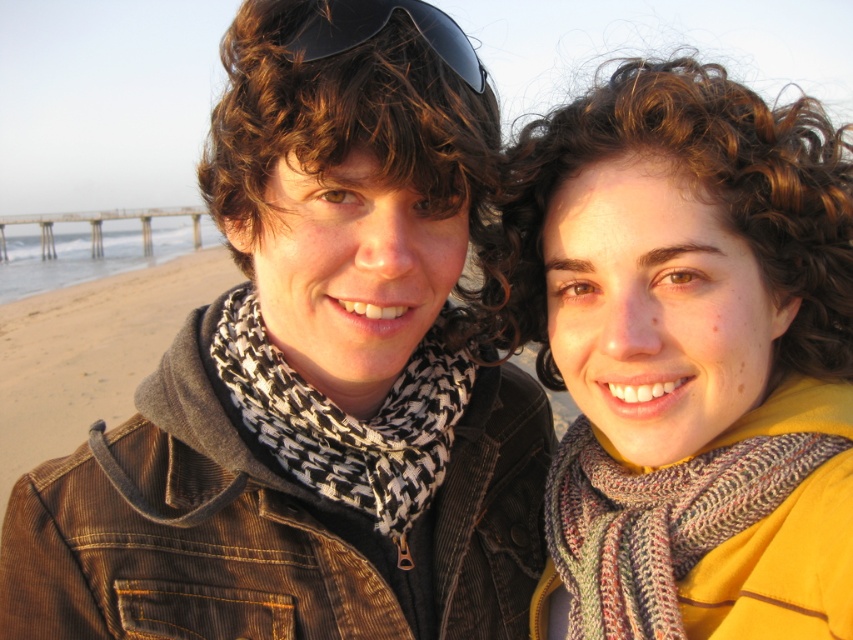
Does knitted scarf at center have a lesser height compared to knitted multicolored scarf at right?

No.

You are a GUI agent. You are given a task and a screenshot of the screen. Output one action in this format:
    pyautogui.click(x=<x>, y=<y>)
    Task: Click on the knitted scarf at center
    This screenshot has width=853, height=640.
    Given the screenshot: What is the action you would take?
    pyautogui.click(x=689, y=356)

You are a GUI agent. You are given a task and a screenshot of the screen. Output one action in this format:
    pyautogui.click(x=<x>, y=<y>)
    Task: Click on the knitted scarf at center
    
    Given the screenshot: What is the action you would take?
    pyautogui.click(x=689, y=356)

Who is taller, knitted scarf at center or houndstooth knitted scarf at center?

With more height is knitted scarf at center.

Is knitted scarf at center thinner than houndstooth knitted scarf at center?

No.

This screenshot has width=853, height=640. I want to click on knitted scarf at center, so click(689, 356).

In the scene shown: Can you confirm if knitted multicolored scarf at right is positioned below black matte sunglasses at upper center?

Yes, knitted multicolored scarf at right is below black matte sunglasses at upper center.

Between point (602, 540) and point (315, 33), which one is positioned in front?

Point (315, 33)

This screenshot has width=853, height=640. What do you see at coordinates (709, 529) in the screenshot?
I see `knitted multicolored scarf at right` at bounding box center [709, 529].

Where is `knitted multicolored scarf at right`? The width and height of the screenshot is (853, 640). knitted multicolored scarf at right is located at coordinates point(709,529).